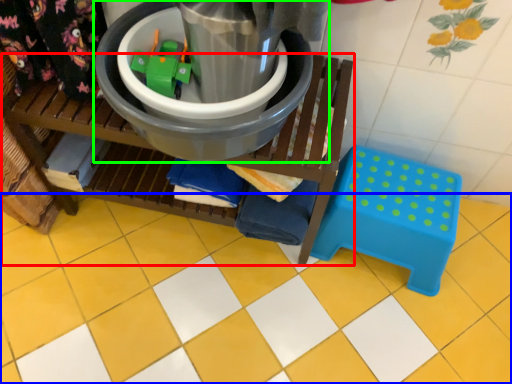
Question: Considering the real-world distances, which object is farthest from furniture (highlighted by a red box)? ceramic tile (highlighted by a blue box) or appliance (highlighted by a green box)?

Choices:
 (A) ceramic tile
 (B) appliance

Answer: (A)